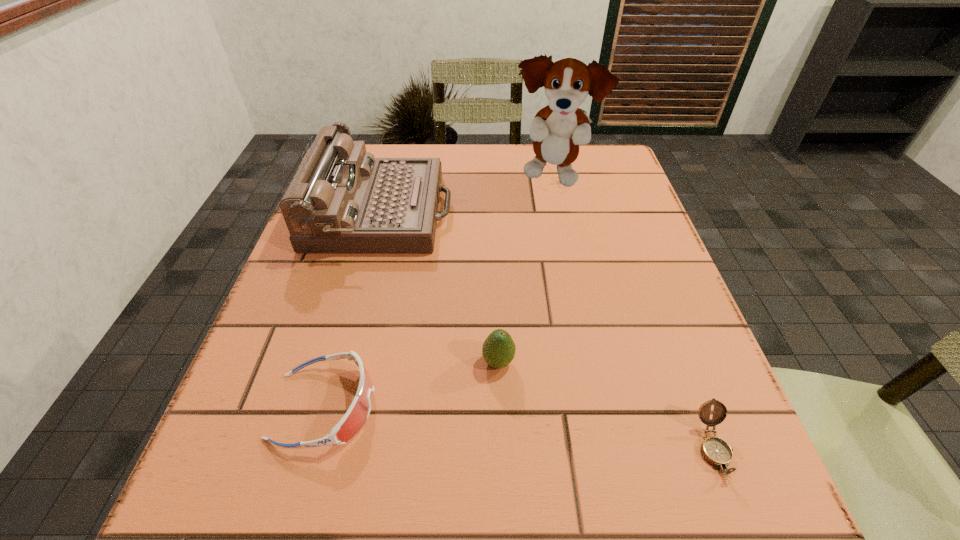
This screenshot has height=540, width=960. Find the location of `the tallest object`. the tallest object is located at coordinates (557, 130).

You are a GUI agent. You are given a task and a screenshot of the screen. Output one action in this format:
    pyautogui.click(x=<x>, y=<y>)
    Task: Click on the puppy
    The image size is (960, 540).
    Given the screenshot: What is the action you would take?
    pyautogui.click(x=557, y=130)

Identify the location of typewriter. This screenshot has width=960, height=540. (342, 200).

I want to click on the third object from left to right, so click(498, 350).

Image resolution: width=960 pixels, height=540 pixels. What are the coordinates of `the third shortest object` in the screenshot? It's located at (498, 350).

Locate an element on the screen. This screenshot has height=540, width=960. the second shortest object is located at coordinates pos(357,414).

The image size is (960, 540). Identify the location of the shortest object. (716, 451).

Where is `the rightmost object`? the rightmost object is located at coordinates (716, 451).

The height and width of the screenshot is (540, 960). Identify the location of vacant area situated 0.380m on the face of the puppy. (583, 321).

Identify the location of free spot located on the keyboard of the typewriter. (497, 212).